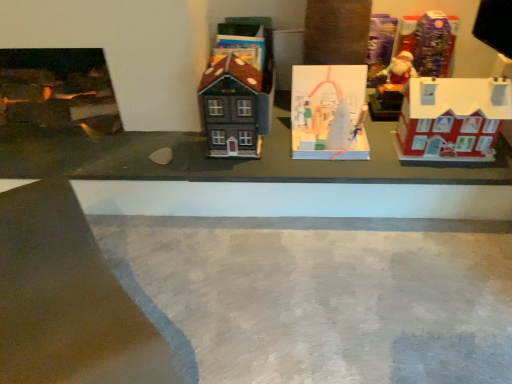
The width and height of the screenshot is (512, 384). What are the coordinates of `white paper ornament at center, acting as the second toy starting from the left` in the screenshot? It's located at (329, 112).

Where is `matte brown house at center, positioned as the first toy in left-to-right order`? This screenshot has width=512, height=384. matte brown house at center, positioned as the first toy in left-to-right order is located at coordinates (233, 108).

Between white paper ornament at center, acting as the second toy starting from the left, and matte red house at right, the 4th toy when ordered from left to right, which one appears on the right side from the viewer's perspective?

matte red house at right, the 4th toy when ordered from left to right.

Based on the photo, choose the correct answer: Is white paper ornament at center, acting as the second toy starting from the left, inside matte red house at right, placed as the 2th toy when sorted from right to left, or outside it?

white paper ornament at center, acting as the second toy starting from the left, is not enclosed by matte red house at right, placed as the 2th toy when sorted from right to left.

From the image's perspective, is white paper ornament at center, which is counted as the 4th toy, starting from the right, located above matte red house at right, placed as the 2th toy when sorted from right to left?

Yes.

Is white paper ornament at center, acting as the second toy starting from the left, in front of or behind shiny plastic santa at upper right, marked as the 1th toy in a right-to-left arrangement, in the image?

white paper ornament at center, acting as the second toy starting from the left, is positioned closer to the viewer than shiny plastic santa at upper right, marked as the 1th toy in a right-to-left arrangement.

From the image's perspective, relative to shiny plastic santa at upper right, which appears as the 5th toy when viewed from the left, is white paper ornament at center, acting as the second toy starting from the left, above or below?

white paper ornament at center, acting as the second toy starting from the left, is below shiny plastic santa at upper right, which appears as the 5th toy when viewed from the left.

Looking at the image, does white paper ornament at center, which is counted as the 4th toy, starting from the right, seem bigger or smaller compared to shiny plastic santa at upper right, marked as the 1th toy in a right-to-left arrangement?

white paper ornament at center, which is counted as the 4th toy, starting from the right, is bigger than shiny plastic santa at upper right, marked as the 1th toy in a right-to-left arrangement.

How distant is white paper ornament at center, which is counted as the 4th toy, starting from the right, from shiny plastic santa at upper right, marked as the 1th toy in a right-to-left arrangement?

The distance of white paper ornament at center, which is counted as the 4th toy, starting from the right, from shiny plastic santa at upper right, marked as the 1th toy in a right-to-left arrangement, is 19.89 inches.

This screenshot has height=384, width=512. I want to click on concrete that is in front of the white paper ornament at center, acting as the second toy starting from the left, so click(321, 296).

Is gray concrete at center in contact with white paper ornament at center, which is counted as the 4th toy, starting from the right?

No, gray concrete at center is not beside white paper ornament at center, which is counted as the 4th toy, starting from the right.

Between gray concrete at center and white paper ornament at center, which is counted as the 4th toy, starting from the right, which one has larger width?

Wider between the two is gray concrete at center.

Which is correct: gray concrete at center is inside white paper ornament at center, which is counted as the 4th toy, starting from the right, or outside of it?

gray concrete at center is outside white paper ornament at center, which is counted as the 4th toy, starting from the right.

Is gray concrete at center wider than matte brown house at center, positioned as the first toy in left-to-right order?

Yes.

Considering the relative sizes of gray concrete at center and matte brown house at center, positioned as the first toy in left-to-right order, in the image provided, is gray concrete at center taller than matte brown house at center, positioned as the first toy in left-to-right order,?

In fact, gray concrete at center may be shorter than matte brown house at center, positioned as the first toy in left-to-right order.

Is gray concrete at center facing away from matte brown house at center, placed as the fifth toy when sorted from right to left?

No, gray concrete at center is not facing the opposite direction of matte brown house at center, placed as the fifth toy when sorted from right to left.

From a real-world perspective, is matte brown house at center, positioned as the first toy in left-to-right order, physically above shiny plastic santa at upper right, marked as the 1th toy in a right-to-left arrangement?

No, from a real-world perspective, matte brown house at center, positioned as the first toy in left-to-right order, is not over shiny plastic santa at upper right, marked as the 1th toy in a right-to-left arrangement

Do you think matte brown house at center, positioned as the first toy in left-to-right order, is within shiny plastic santa at upper right, which appears as the 5th toy when viewed from the left, or outside of it?

matte brown house at center, positioned as the first toy in left-to-right order, is not inside shiny plastic santa at upper right, which appears as the 5th toy when viewed from the left, it's outside.

Which object is positioned more to the left, matte brown house at center, placed as the fifth toy when sorted from right to left, or shiny plastic santa at upper right, which appears as the 5th toy when viewed from the left?

matte brown house at center, placed as the fifth toy when sorted from right to left, is more to the left.

Is matte brown house at center, placed as the fifth toy when sorted from right to left, not close to shiny plastic santa at upper right, which appears as the 5th toy when viewed from the left?

Actually, matte brown house at center, placed as the fifth toy when sorted from right to left, and shiny plastic santa at upper right, which appears as the 5th toy when viewed from the left, are a little close together.

Considering the relative sizes of white paper ornament at center, acting as the second toy starting from the left, and gray concrete at center in the image provided, is white paper ornament at center, acting as the second toy starting from the left, shorter than gray concrete at center?

No, white paper ornament at center, acting as the second toy starting from the left, is not shorter than gray concrete at center.

Is white paper ornament at center, which is counted as the 4th toy, starting from the right, inside the boundaries of gray concrete at center, or outside?

white paper ornament at center, which is counted as the 4th toy, starting from the right, cannot be found inside gray concrete at center.

Which object is closer to the camera taking this photo, white paper ornament at center, acting as the second toy starting from the left, or gray concrete at center?

gray concrete at center is more forward.

Does point (295, 126) lie in front of point (369, 310)?

No, it is not.

Looking at this image, is shiny plastic santa at upper right, marked as the 1th toy in a right-to-left arrangement, turned away from gray concrete at center?

shiny plastic santa at upper right, marked as the 1th toy in a right-to-left arrangement, does not have its back to gray concrete at center.

Considering the sizes of objects shiny plastic santa at upper right, marked as the 1th toy in a right-to-left arrangement, and gray concrete at center in the image provided, who is bigger, shiny plastic santa at upper right, marked as the 1th toy in a right-to-left arrangement, or gray concrete at center?

gray concrete at center is bigger.

From the image's perspective, is shiny plastic santa at upper right, marked as the 1th toy in a right-to-left arrangement, above gray concrete at center?

Yes, from the image's perspective, shiny plastic santa at upper right, marked as the 1th toy in a right-to-left arrangement, is above gray concrete at center.

Find the location of a particular element. Image resolution: width=512 pixels, height=384 pixels. toy below the white paper ornament at center, which is counted as the 4th toy, starting from the right (from the image's perspective) is located at coordinates (452, 118).

From a real-world perspective, which toy is the 4th one above the white paper ornament at center, which is counted as the 4th toy, starting from the right? Please provide its 2D coordinates.

[(432, 44)]

From the image, which object appears to be nearer to matte brown house at center, positioned as the first toy in left-to-right order, white paper ornament at center, acting as the second toy starting from the left, or matte plastic santa at upper right, the third toy from the right?

white paper ornament at center, acting as the second toy starting from the left, lies closer to matte brown house at center, positioned as the first toy in left-to-right order, than the other object.

When comparing their distances from gray concrete at center, does matte brown house at center, placed as the fifth toy when sorted from right to left, or shiny plastic santa at upper right, which appears as the 5th toy when viewed from the left, seem closer?

The object closer to gray concrete at center is matte brown house at center, placed as the fifth toy when sorted from right to left.

Looking at the image, which one is located further to shiny plastic santa at upper right, marked as the 1th toy in a right-to-left arrangement, gray concrete at center or matte plastic santa at upper right, which is the third toy in left-to-right order?

gray concrete at center is further to shiny plastic santa at upper right, marked as the 1th toy in a right-to-left arrangement.

Looking at the image, which one is located closer to matte brown house at center, placed as the fifth toy when sorted from right to left, shiny plastic santa at upper right, which appears as the 5th toy when viewed from the left, or white paper ornament at center, which is counted as the 4th toy, starting from the right?

white paper ornament at center, which is counted as the 4th toy, starting from the right, is positioned closer to the anchor matte brown house at center, placed as the fifth toy when sorted from right to left.

Based on their spatial positions, is matte red house at right, placed as the 2th toy when sorted from right to left, or shiny plastic santa at upper right, which appears as the 5th toy when viewed from the left, further from gray concrete at center?

shiny plastic santa at upper right, which appears as the 5th toy when viewed from the left.

Looking at the image, which one is located further to gray concrete at center, white paper ornament at center, acting as the second toy starting from the left, or matte brown house at center, placed as the fifth toy when sorted from right to left?

matte brown house at center, placed as the fifth toy when sorted from right to left.

From the image, which object appears to be nearer to matte red house at right, the 4th toy when ordered from left to right, matte plastic santa at upper right, the third toy from the right, or shiny plastic santa at upper right, marked as the 1th toy in a right-to-left arrangement?

shiny plastic santa at upper right, marked as the 1th toy in a right-to-left arrangement, is positioned closer to the anchor matte red house at right, the 4th toy when ordered from left to right.

Considering their positions, is matte brown house at center, positioned as the first toy in left-to-right order, positioned further to shiny plastic santa at upper right, marked as the 1th toy in a right-to-left arrangement, than white paper ornament at center, acting as the second toy starting from the left?

matte brown house at center, positioned as the first toy in left-to-right order, is positioned further to the anchor shiny plastic santa at upper right, marked as the 1th toy in a right-to-left arrangement.

Where is `toy that lies between white paper ornament at center, which is counted as the 4th toy, starting from the right, and gray concrete at center from top to bottom`? toy that lies between white paper ornament at center, which is counted as the 4th toy, starting from the right, and gray concrete at center from top to bottom is located at coordinates (452, 118).

I want to click on toy located between matte brown house at center, placed as the fifth toy when sorted from right to left, and matte plastic santa at upper right, the third toy from the right, in the left-right direction, so click(329, 112).

You are a GUI agent. You are given a task and a screenshot of the screen. Output one action in this format:
    pyautogui.click(x=<x>, y=<y>)
    Task: Click on the toy situated between white paper ornament at center, which is counted as the 4th toy, starting from the right, and matte red house at right, placed as the 2th toy when sorted from right to left, from left to right
    Image resolution: width=512 pixels, height=384 pixels.
    Given the screenshot: What is the action you would take?
    pyautogui.click(x=380, y=46)

Locate an element on the screen. concrete between matte brown house at center, placed as the fifth toy when sorted from right to left, and matte red house at right, the 4th toy when ordered from left to right, from left to right is located at coordinates (321, 296).